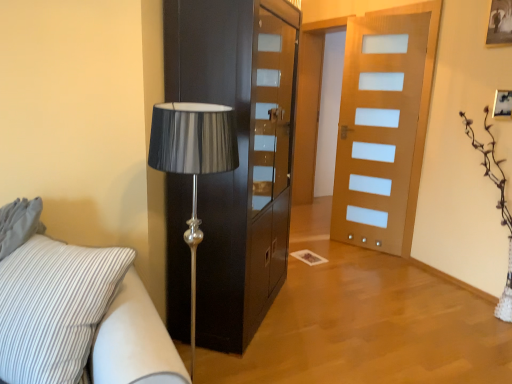
Question: From a real-world perspective, is white striped fabric studio couch at lower left physically located above or below black glossy cabinet at center?

Choices:
 (A) below
 (B) above

Answer: (A)

Question: Is white striped fabric studio couch at lower left bigger or smaller than black glossy cabinet at center?

Choices:
 (A) small
 (B) big

Answer: (A)

Question: Which of these objects is positioned closest to the white striped fabric studio couch at lower left?

Choices:
 (A) black glossy cabinet at center
 (B) wooden door at center
 (C) wooden picture frame at upper right

Answer: (A)

Question: Estimate the real-world distances between objects in this image. Which object is closer to the wooden door at center?

Choices:
 (A) wooden picture frame at upper right
 (B) white striped fabric studio couch at lower left
 (C) black glossy cabinet at center

Answer: (A)